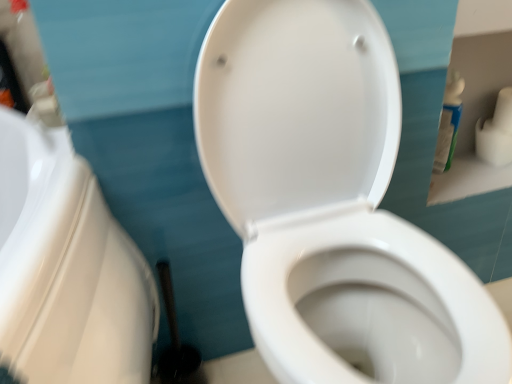
Question: From the image's perspective, is white matte toilet paper at upper right located beneath white plastic bottle at upper right?

Choices:
 (A) no
 (B) yes

Answer: (A)

Question: Is white matte toilet paper at upper right wider than white plastic bottle at upper right?

Choices:
 (A) yes
 (B) no

Answer: (A)

Question: Is white matte toilet paper at upper right not within white plastic bottle at upper right?

Choices:
 (A) no
 (B) yes

Answer: (B)

Question: Is white matte toilet paper at upper right taller than white plastic bottle at upper right?

Choices:
 (A) no
 (B) yes

Answer: (A)

Question: Is white plastic bottle at upper right at the back of white matte toilet paper at upper right?

Choices:
 (A) no
 (B) yes

Answer: (A)

Question: From the image's perspective, would you say white matte toilet paper at upper right is positioned over white plastic bottle at upper right?

Choices:
 (A) no
 (B) yes

Answer: (B)

Question: Is white glossy toilet at center outside white plastic bottle at upper right?

Choices:
 (A) yes
 (B) no

Answer: (A)

Question: Considering the relative positions of white glossy toilet at center and white plastic bottle at upper right in the image provided, is white glossy toilet at center to the left of white plastic bottle at upper right from the viewer's perspective?

Choices:
 (A) no
 (B) yes

Answer: (B)

Question: Can you confirm if white glossy toilet at center is positioned to the right of white plastic bottle at upper right?

Choices:
 (A) no
 (B) yes

Answer: (A)

Question: Considering the relative sizes of white glossy toilet at center and white plastic bottle at upper right in the image provided, is white glossy toilet at center thinner than white plastic bottle at upper right?

Choices:
 (A) yes
 (B) no

Answer: (B)

Question: Is white glossy toilet at center not near white plastic bottle at upper right?

Choices:
 (A) yes
 (B) no

Answer: (B)

Question: Is white plastic bottle at upper right a part of white glossy toilet at center?

Choices:
 (A) yes
 (B) no

Answer: (B)

Question: From a real-world perspective, is white plastic bottle at upper right physically below white glossy toilet at center?

Choices:
 (A) no
 (B) yes

Answer: (B)